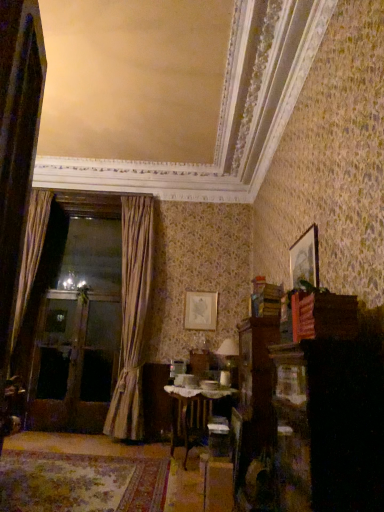
Question: Which direction should I rotate to look at matte gold picture frame at center, which appears as the 1th picture frame when viewed from the back?

Choices:
 (A) left
 (B) right

Answer: (B)

Question: Can we say gold textured curtain at left, placed as the 2th curtain when sorted from left to right, lies outside matte gold picture frame at center, the 2th picture frame from the top?

Choices:
 (A) yes
 (B) no

Answer: (A)

Question: Is the depth of gold textured curtain at left, the first curtain positioned from the right, less than that of matte gold picture frame at center, which ranks as the first picture frame in left-to-right order?

Choices:
 (A) no
 (B) yes

Answer: (B)

Question: Is gold textured curtain at left, placed as the 2th curtain when sorted from left to right, at the left side of matte gold picture frame at center, marked as the second picture frame in a front-to-back arrangement?

Choices:
 (A) no
 (B) yes

Answer: (B)

Question: From a real-world perspective, does gold textured curtain at left, the first curtain positioned from the right, sit lower than matte gold picture frame at center, which appears as the 1th picture frame when viewed from the back?

Choices:
 (A) no
 (B) yes

Answer: (B)

Question: Can you confirm if gold textured curtain at left, placed as the 2th curtain when sorted from left to right, is wider than matte gold picture frame at center, which is counted as the first picture frame, starting from the bottom?

Choices:
 (A) yes
 (B) no

Answer: (A)

Question: Does gold textured curtain at left, the first curtain positioned from the right, have a larger size compared to matte gold picture frame at center, which is counted as the first picture frame, starting from the bottom?

Choices:
 (A) no
 (B) yes

Answer: (B)

Question: Is there a large distance between wooden table at center and gold textured curtain at left, placed as the 2th curtain when sorted from left to right?

Choices:
 (A) yes
 (B) no

Answer: (A)

Question: Is wooden table at center closer to the viewer compared to gold textured curtain at left, the first curtain positioned from the right?

Choices:
 (A) yes
 (B) no

Answer: (A)

Question: Is wooden table at center smaller than gold textured curtain at left, the first curtain positioned from the right?

Choices:
 (A) yes
 (B) no

Answer: (A)

Question: From the image's perspective, is wooden table at center below gold textured curtain at left, placed as the 2th curtain when sorted from left to right?

Choices:
 (A) yes
 (B) no

Answer: (A)

Question: Considering the relative positions of wooden table at center and gold textured curtain at left, placed as the 2th curtain when sorted from left to right, in the image provided, is wooden table at center behind gold textured curtain at left, placed as the 2th curtain when sorted from left to right,?

Choices:
 (A) no
 (B) yes

Answer: (A)

Question: Is gold textured curtain at left, the first curtain positioned from the right, a part of wooden table at center?

Choices:
 (A) no
 (B) yes

Answer: (A)

Question: Can you confirm if wooden table at center is shorter than matte gold picture frame at center, which ranks as the first picture frame in left-to-right order?

Choices:
 (A) yes
 (B) no

Answer: (B)